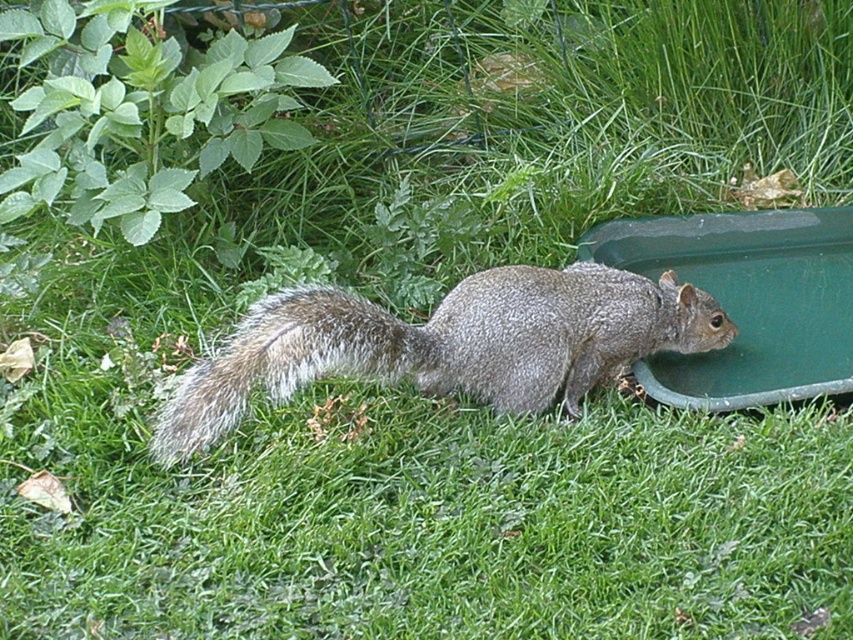
You are observing a squirrel in a natural setting. You notice two points marked in the image. The first point is at coordinate point [360,333] and the second is at point [787,282]. From your perspective, which point is closer to you?

Point [360,333] is closer to the camera than point [787,282].

You are a photographer trying to capture the squirrel without moving it. You want to place a treat to the left of its tail to distract it. Based on the scene, can you confirm if the green plastic tray at lower right is to the right of the fuzzy gray tail at center?

The green plastic tray at lower right is positioned on the right side of the fuzzy gray tail at center, so yes, the tray is to the right of the tail.

You are a photographer trying to capture a closeup of the gray furry squirrel at center and the green plastic tray at lower right. Since you want to focus on the squirrel, which object should you make sure is closer to the camera lens?

The gray furry squirrel at center is larger in size compared to the green plastic tray at lower right. To focus on the squirrel, you should position the gray furry squirrel at center closer to the camera lens since its larger size will fill the frame better for a closeup.